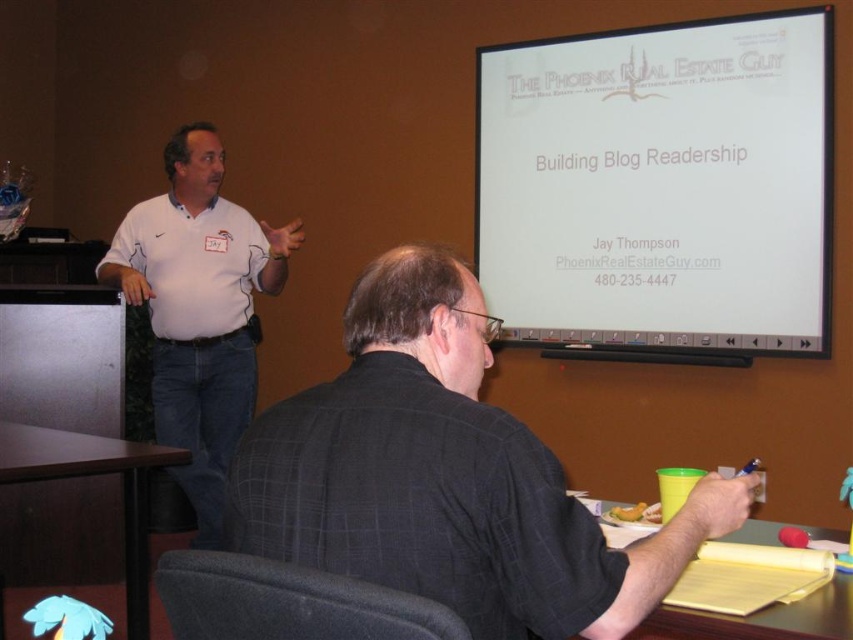
You are an attendee at the presentation. You need to take a photo of the slide on the white matte projection screen at upper center but your phone is in your pocket near the white shirt at left. Can you reach the phone without leaving your seat?

The white matte projection screen at upper center is located above the white shirt at left, so the phone is near the white shirt at left. Since the projection screen is above the shirt, you can likely reach the phone in your pocket near the white shirt at left without leaving your seat.

You are an attendee at the presentation and need to take notes. You have a yellow paper at lower right and a white matte projection screen at upper center. Which surface can you write on?

The yellow paper at lower right is a writable surface, while the white matte projection screen at upper center is used for displaying projections and cannot be written on. Therefore, you should use the yellow paper at lower right for taking notes.

You are standing in the presentation room and want to focus your camera on both the presenter and the projection screen. The presenter is at point (x=534, y=280) and the screen is at point (x=837, y=589). Which point should you adjust your camera focus to first to ensure both are in focus?

You should focus on point (x=534, y=280) first because it is closer to the camera than point (x=837, y=589). This way, adjusting focus from near to far will help both points come into focus.